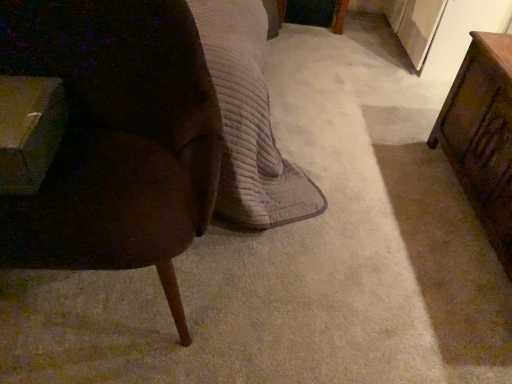
Question: Does wooden table at right, the second table viewed from the left, have a lesser width compared to wooden table at left, arranged as the second table when viewed from the right?

Choices:
 (A) yes
 (B) no

Answer: (B)

Question: Is wooden table at left, arranged as the 1th table when viewed from the left, at the back of wooden table at right, which is the first table in right-to-left order?

Choices:
 (A) yes
 (B) no

Answer: (B)

Question: Considering the relative positions of wooden table at right, which is the first table in right-to-left order, and wooden table at left, arranged as the 1th table when viewed from the left, in the image provided, is wooden table at right, which is the first table in right-to-left order, to the left of wooden table at left, arranged as the 1th table when viewed from the left, from the viewer's perspective?

Choices:
 (A) no
 (B) yes

Answer: (A)

Question: From a real-world perspective, is wooden table at right, which is the first table in right-to-left order, located higher than wooden table at left, arranged as the 1th table when viewed from the left?

Choices:
 (A) yes
 (B) no

Answer: (B)

Question: Does wooden table at right, which is the first table in right-to-left order, have a larger size compared to wooden table at left, arranged as the 1th table when viewed from the left?

Choices:
 (A) yes
 (B) no

Answer: (A)

Question: Is wooden table at right, which is the first table in right-to-left order, positioned in front of wooden table at left, arranged as the 1th table when viewed from the left?

Choices:
 (A) yes
 (B) no

Answer: (B)

Question: Can you confirm if wooden table at left, arranged as the second table when viewed from the right, is bigger than velvet brown chair at left?

Choices:
 (A) yes
 (B) no

Answer: (B)

Question: Does wooden table at left, arranged as the 1th table when viewed from the left, have a greater width compared to velvet brown chair at left?

Choices:
 (A) yes
 (B) no

Answer: (B)

Question: Does wooden table at left, arranged as the second table when viewed from the right, appear on the left side of velvet brown chair at left?

Choices:
 (A) no
 (B) yes

Answer: (B)

Question: From the image's perspective, is wooden table at left, arranged as the second table when viewed from the right, over velvet brown chair at left?

Choices:
 (A) yes
 (B) no

Answer: (A)

Question: Is wooden table at left, arranged as the second table when viewed from the right, facing towards velvet brown chair at left?

Choices:
 (A) no
 (B) yes

Answer: (B)

Question: Considering the relative sizes of wooden table at left, arranged as the second table when viewed from the right, and velvet brown chair at left in the image provided, is wooden table at left, arranged as the second table when viewed from the right, smaller than velvet brown chair at left?

Choices:
 (A) no
 (B) yes

Answer: (B)

Question: From a real-world perspective, is wooden table at left, arranged as the 1th table when viewed from the left, under wooden table at right, the second table viewed from the left?

Choices:
 (A) no
 (B) yes

Answer: (A)